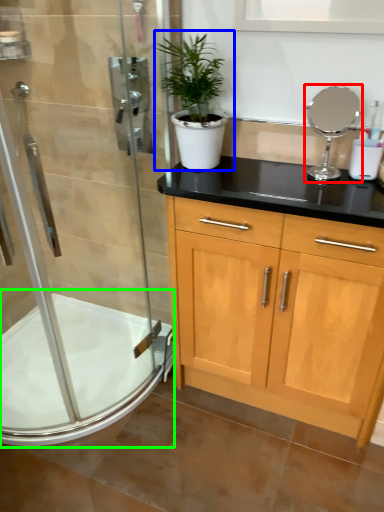
Question: Which object is positioned closest to mirror (highlighted by a red box)? Select from houseplant (highlighted by a blue box) and bath (highlighted by a green box).

Choices:
 (A) houseplant
 (B) bath

Answer: (A)